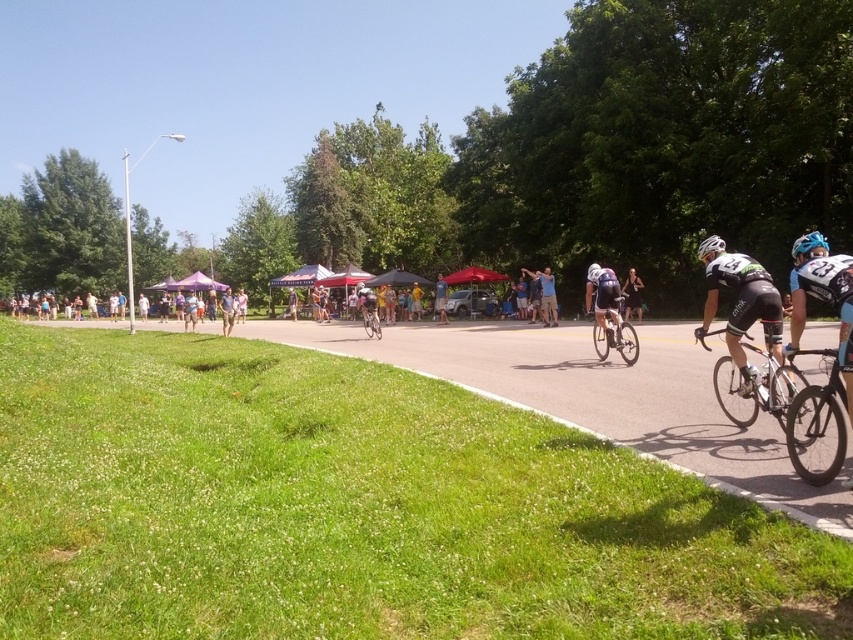
Between shiny blue jersey at center and light blue fabric umbrella at center, which one has more height?

shiny blue jersey at center is taller.

Is point (590, 285) closer to viewer compared to point (186, 298)?

Yes.

Locate an element on the screen. This screenshot has height=640, width=853. shiny blue jersey at center is located at coordinates pos(602,298).

Identify the location of shiny blue helmet at center right. (808, 243).

Can you confirm if shiny blue helmet at center right is bigger than light blue fabric at center?

Actually, shiny blue helmet at center right might be smaller than light blue fabric at center.

Is point (817, 237) in front of point (241, 317)?

That is True.

At what (x,y) coordinates should I click in order to perform the action: click on shiny blue helmet at center right. Please return your answer as a coordinate pair (x, y). This screenshot has width=853, height=640. Looking at the image, I should click on (808, 243).

Does shiny black bike at lower right appear on the right side of yellow fabric at center?

Indeed, shiny black bike at lower right is positioned on the right side of yellow fabric at center.

Does shiny black bike at lower right appear over yellow fabric at center?

Incorrect, shiny black bike at lower right is not positioned above yellow fabric at center.

Between point (816, 410) and point (418, 307), which one is positioned behind?

The point (418, 307) is behind.

You are a GUI agent. You are given a task and a screenshot of the screen. Output one action in this format:
    pyautogui.click(x=<x>, y=<y>)
    Task: Click on the shiny black bike at lower right
    Image resolution: width=853 pixels, height=640 pixels.
    Given the screenshot: What is the action you would take?
    pyautogui.click(x=817, y=419)